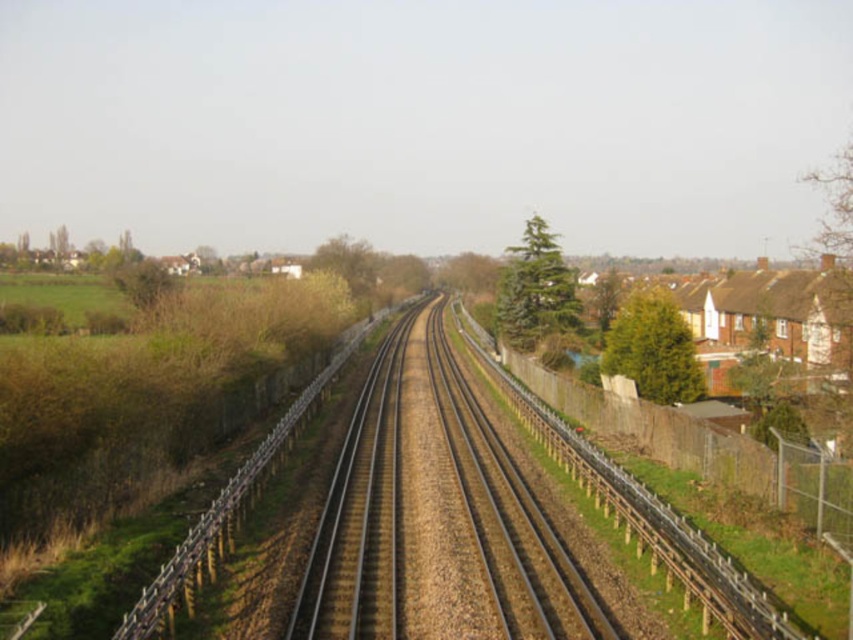
You are standing on the railway tracks and want to walk to the green textured tree at right. The railway tracks are 1.43 meters wide. If you walk straight towards the tree, will you be able to step onto the tracks and reach it without crossing the tracks?

The green textured tree at right is 29.49 meters away from you. Since the railway tracks are only 1.43 meters wide, you would have to walk along the tracks for 29.49 meters to reach the tree. However, stepping onto the tracks is dangerous and not advisable. Please stay off the tracks for your safety.

You are standing on the railway track and looking towards the horizon. There are two points marked on the track at coordinates point (x=469, y=387) and point (x=682, y=317). Which point is closer to you?

Point (x=469, y=387) is closer to you because it is further to the viewer than point (x=682, y=317).